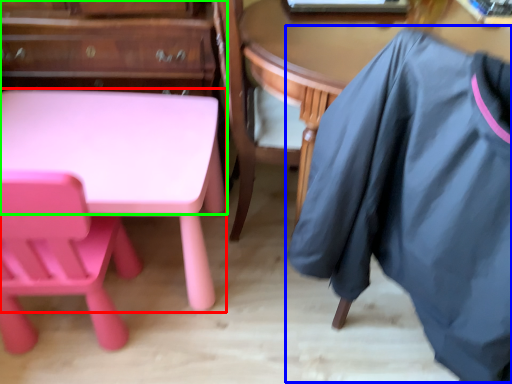
Question: Which is nearer to the desk (highlighted by a red box)? clothing (highlighted by a blue box) or dresser (highlighted by a green box).

Choices:
 (A) clothing
 (B) dresser

Answer: (B)